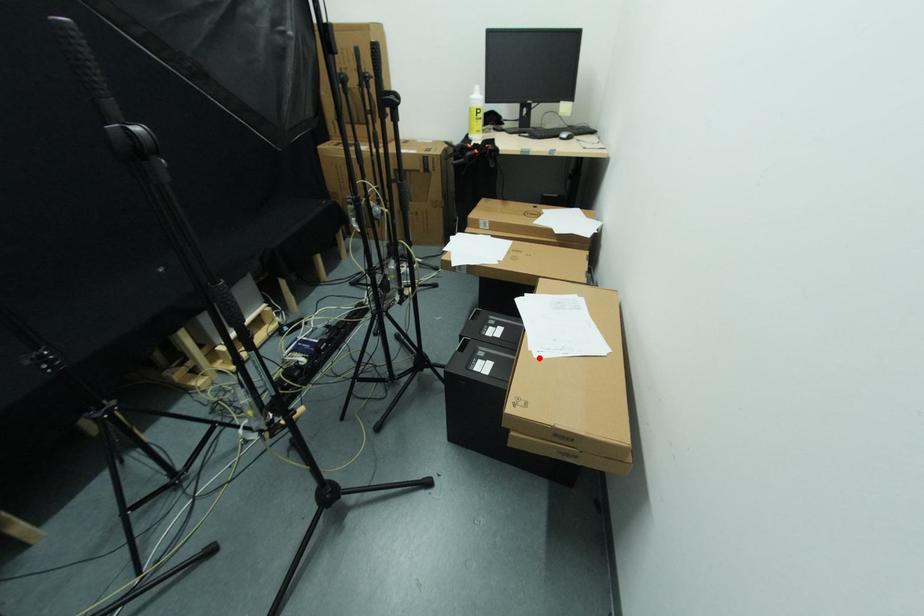
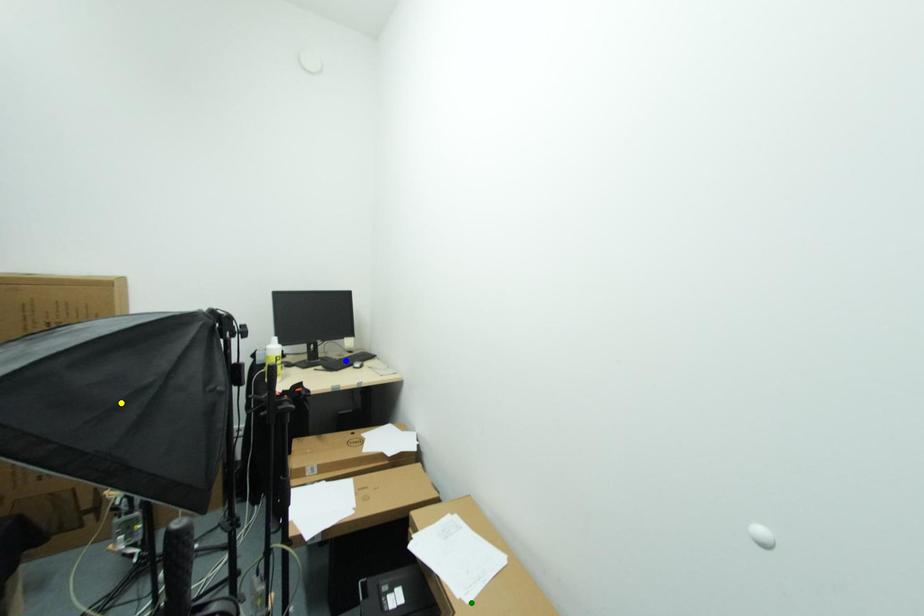
Question: I am providing you with two images of the same scene from different viewpoints. A red point is marked on the first image. You are given multiple points on the second image. Which point in image 2 represents the same 3d spot as the red point in image 1?

Choices:
 (A) green point
 (B) yellow point
 (C) blue point

Answer: (A)